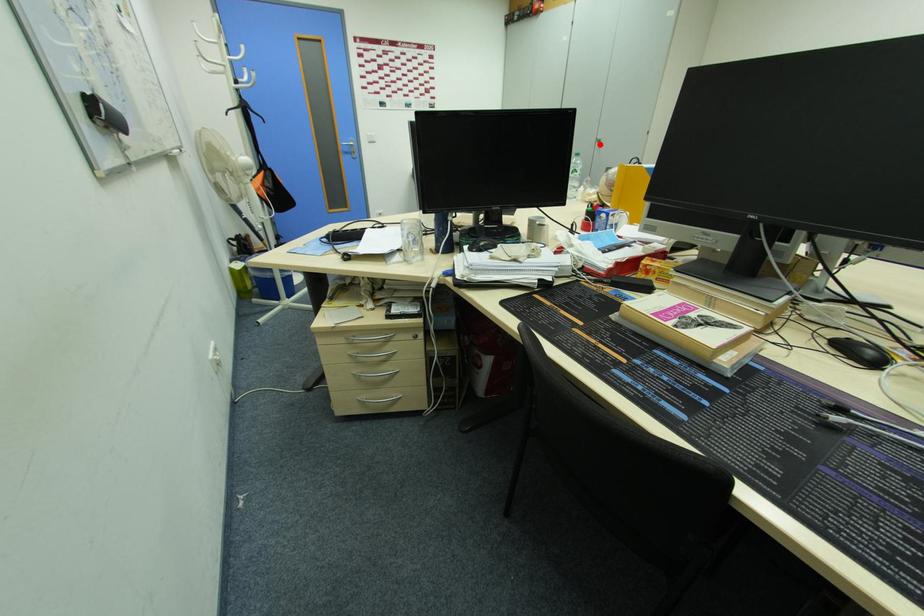
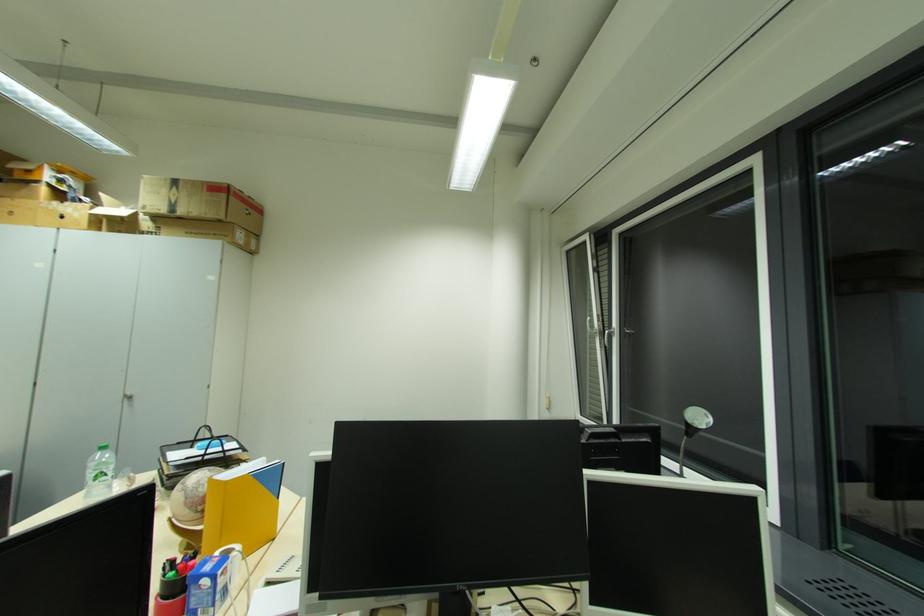
Question: I am providing you with two images of the same scene from different viewpoints. In image1, a red point is highlighted. Considering the same 3D point in image2, which of the following is correct?

Choices:
 (A) It is closer
 (B) It is farther

Answer: (B)